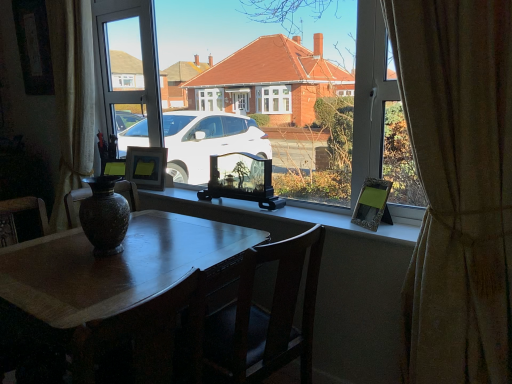
Where is `vacant space to the left of marbled stone vase at center`? This screenshot has height=384, width=512. vacant space to the left of marbled stone vase at center is located at coordinates pos(53,250).